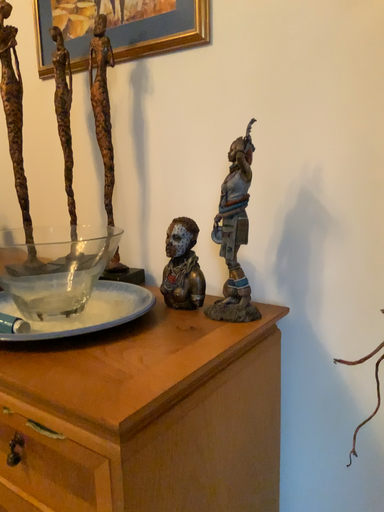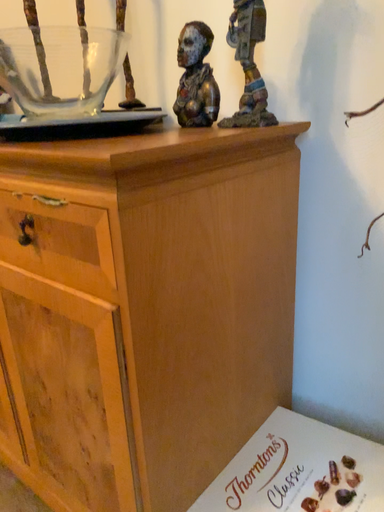
Question: How did the camera likely rotate when shooting the video?

Choices:
 (A) rotated upward
 (B) rotated downward

Answer: (B)